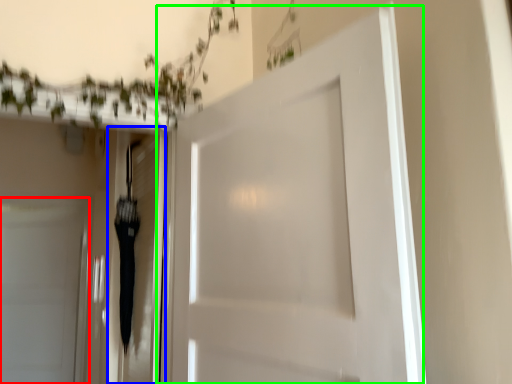
Question: Which object is the closest to the door (highlighted by a red box)? Choose among these: elevator (highlighted by a blue box) or door (highlighted by a green box).

Choices:
 (A) elevator
 (B) door

Answer: (A)